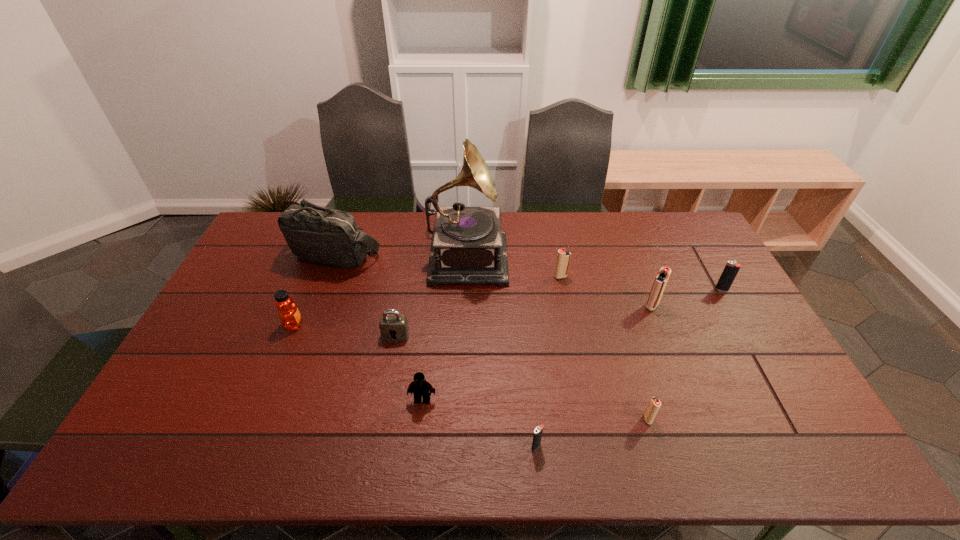
At what (x,y) coordinates should I click in order to perform the action: click on object at the left edge. Please return your answer as a coordinate pair (x, y). The image size is (960, 540). Looking at the image, I should click on (319, 235).

Where is `object present at the right edge`? The image size is (960, 540). object present at the right edge is located at coordinates (731, 269).

Where is `object at the far left corner`? Image resolution: width=960 pixels, height=540 pixels. object at the far left corner is located at coordinates (319, 235).

Locate an element on the screen. The image size is (960, 540). blank area at the far edge is located at coordinates (577, 234).

Image resolution: width=960 pixels, height=540 pixels. Identify the location of free space at the near edge of the desktop. (604, 447).

Image resolution: width=960 pixels, height=540 pixels. In the image, there is a desktop. In order to click on vacant space at the right edge in this screenshot , I will do `click(690, 288)`.

What are the coordinates of `vacant space at the far left corner of the desktop` in the screenshot? It's located at (276, 226).

Identify the location of vacant space at the far right corner. (656, 224).

Identify the location of empty location between the second tallest object and the nearest igniter. Image resolution: width=960 pixels, height=540 pixels. (436, 351).

Locate an element on the screen. The height and width of the screenshot is (540, 960). free space between the farther black igniter and the record player is located at coordinates (594, 272).